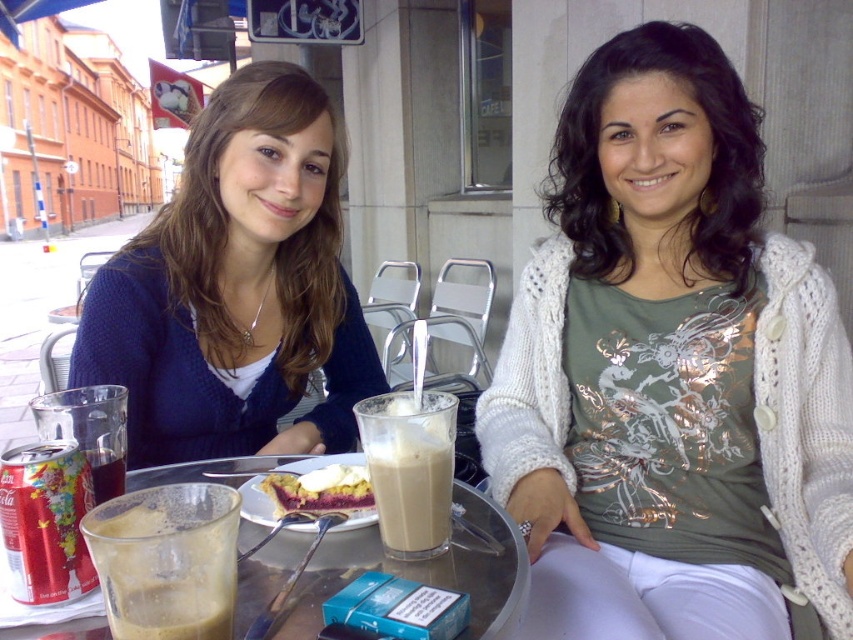
Question: Can you confirm if transparent glass at center is positioned above dark brown liquid at lower left?

Choices:
 (A) no
 (B) yes

Answer: (A)

Question: Does translucent glass cup at lower left have a larger size compared to milkshake-like liquid at center?

Choices:
 (A) no
 (B) yes

Answer: (A)

Question: Can you confirm if matte blue sweater at center is bigger than dark purple crumbly pie at center?

Choices:
 (A) yes
 (B) no

Answer: (A)

Question: Which point is farther to the camera?

Choices:
 (A) (113, 488)
 (B) (271, 468)
 (C) (222, 164)

Answer: (C)

Question: Which point appears closest to the camera in this image?

Choices:
 (A) (485, 557)
 (B) (422, 419)
 (C) (682, 228)
 (D) (102, 483)

Answer: (B)

Question: Which point is closer to the camera?

Choices:
 (A) (155, 556)
 (B) (291, 253)
 (C) (490, 502)
 (D) (637, 342)

Answer: (A)